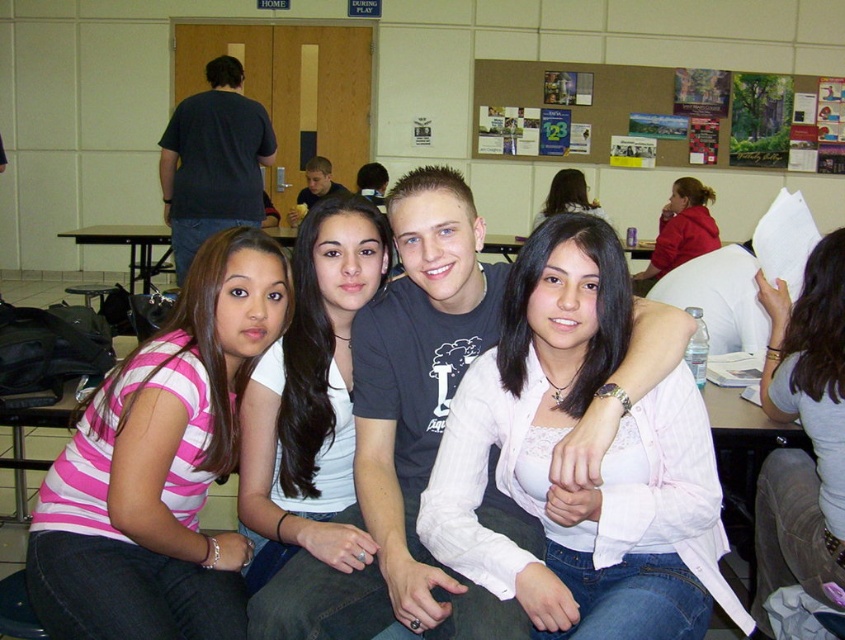
Question: Can you confirm if pink satin blouse at center is positioned to the right of matte red hoodie at upper right?

Choices:
 (A) no
 (B) yes

Answer: (A)

Question: Among these objects, which one is nearest to the camera?

Choices:
 (A) white matte shirt at center
 (B) matte red hoodie at upper right
 (C) pink satin blouse at center

Answer: (C)

Question: Does pink striped shirt at lower left have a greater width compared to gray fabric pants at lower right?

Choices:
 (A) yes
 (B) no

Answer: (A)

Question: Which of the following is the closest to the observer?

Choices:
 (A) matte red hoodie at upper right
 (B) smooth white blouse at center
 (C) wooden corkboard at upper center
 (D) pink striped shirt at lower left

Answer: (D)

Question: Is the position of pink satin blouse at center more distant than that of white matte shirt at center?

Choices:
 (A) no
 (B) yes

Answer: (A)

Question: Which object is closer to the camera taking this photo?

Choices:
 (A) pink striped shirt at lower left
 (B) smooth white blouse at center
 (C) gray fabric pants at lower right

Answer: (A)